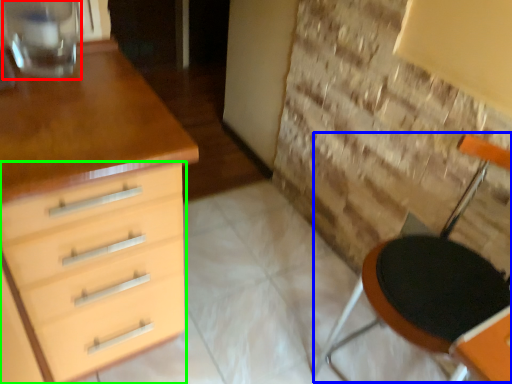
Question: Estimate the real-world distances between objects in this image. Which object is farther from glass vase (highlighted by a red box), armchair (highlighted by a blue box) or chest of drawers (highlighted by a green box)?

Choices:
 (A) armchair
 (B) chest of drawers

Answer: (A)